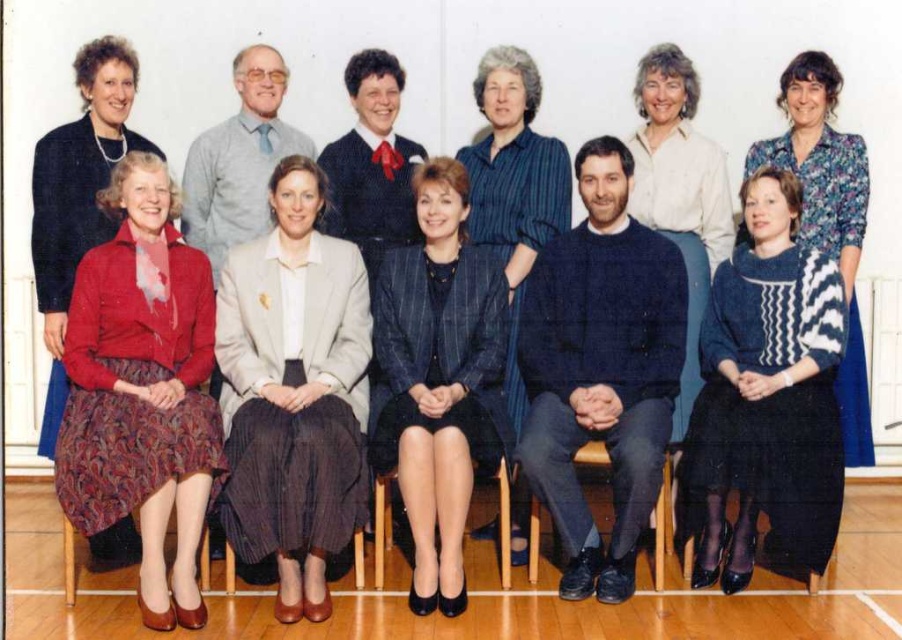
Question: Which object is farther from the camera taking this photo?

Choices:
 (A) blue striped shirt at center
 (B) matte red dress at lower left
 (C) wooden chair at center
 (D) floral-patterned blouse at upper right

Answer: (A)

Question: Which point is farther from the camera taking this photo?

Choices:
 (A) (159, 272)
 (B) (513, 524)

Answer: (B)

Question: Can you confirm if matte red sweater at lower left is positioned to the right of matte blue blouse at center?

Choices:
 (A) no
 (B) yes

Answer: (A)

Question: Is light beige fabric blazer at center positioned before dark blue pinstripe suit at center?

Choices:
 (A) yes
 (B) no

Answer: (A)

Question: Can you confirm if matte red sweater at lower left is positioned above matte red dress at lower left?

Choices:
 (A) no
 (B) yes

Answer: (A)

Question: Which object appears farthest from the camera in this image?

Choices:
 (A) dark blue pinstripe suit at center
 (B) wooden chair at center

Answer: (A)